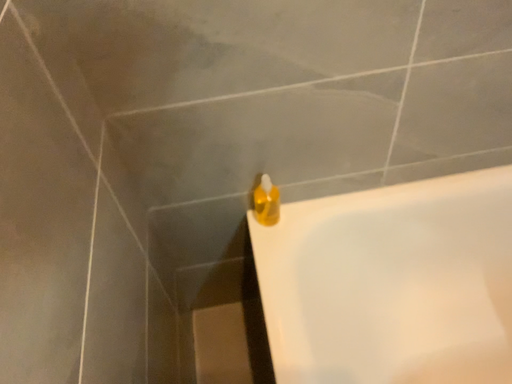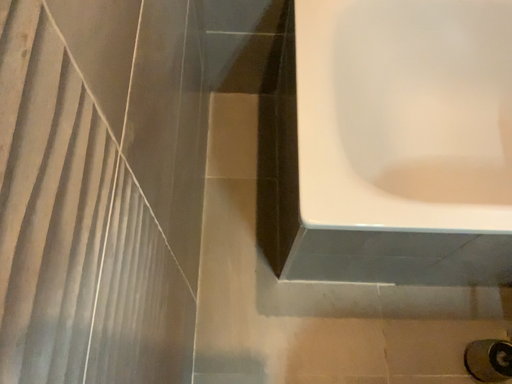
Question: How did the camera likely rotate when shooting the video?

Choices:
 (A) rotated upward
 (B) rotated downward

Answer: (B)